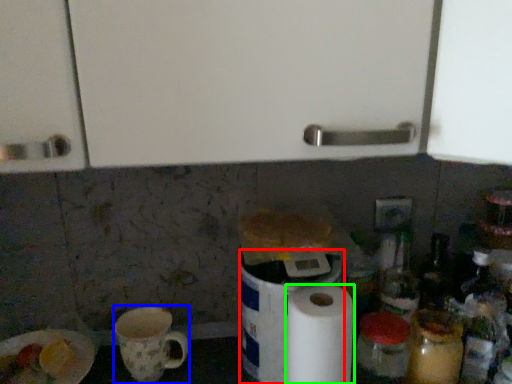
Question: Considering the real-world distances, which object is closest to appliance (highlighted by a red box)? mug (highlighted by a blue box) or paper towel (highlighted by a green box).

Choices:
 (A) mug
 (B) paper towel

Answer: (B)